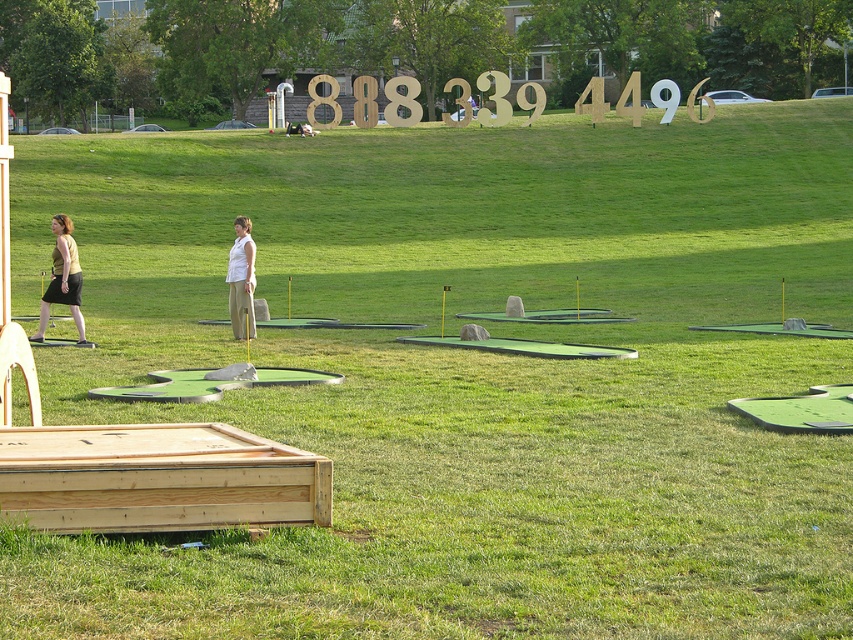
Does matte yellow shirt at left have a lesser width compared to white cotton shirt at center?

No.

Can you confirm if matte yellow shirt at left is positioned below white cotton shirt at center?

Correct, matte yellow shirt at left is located below white cotton shirt at center.

Is point (71, 248) less distant than point (241, 272)?

Yes, it is in front of point (241, 272).

This screenshot has height=640, width=853. Find the location of `matte yellow shirt at left`. matte yellow shirt at left is located at coordinates [62, 278].